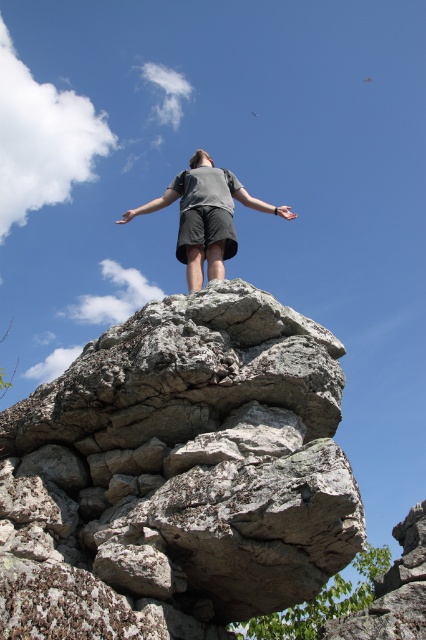
You are a photographer trying to capture the scene from below. You notice the gray rough rock at center and the gray matte shorts at center. Which object is closer to the camera?

The gray rough rock at center is in front of the gray matte shorts at center, so the gray rough rock at center is closer to the camera.

You are a photographer planning to capture the scene from the same angle. The gray rough rock at center and the gray matte shorts at center are both in your frame. Which object appears wider in the photo?

The gray matte shorts at center appears wider in the photo since the gray rough rock at center has a lesser width compared to it.